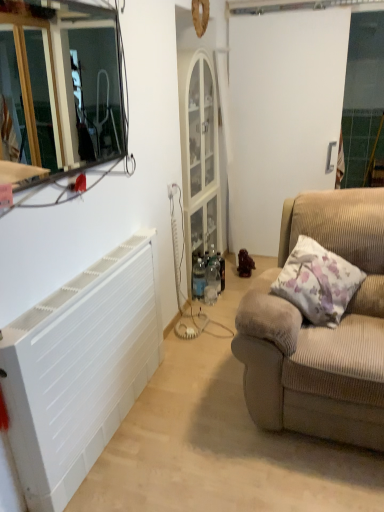
Question: Should I look upward or downward to see metallic glass window frame at upper left?

Choices:
 (A) down
 (B) up

Answer: (B)

Question: Considering the relative sizes of fluffy beige pillow at right and metallic glass window frame at upper left in the image provided, is fluffy beige pillow at right smaller than metallic glass window frame at upper left?

Choices:
 (A) yes
 (B) no

Answer: (B)

Question: Is fluffy beige pillow at right turned away from metallic glass window frame at upper left?

Choices:
 (A) no
 (B) yes

Answer: (A)

Question: Is metallic glass window frame at upper left located within fluffy beige pillow at right?

Choices:
 (A) yes
 (B) no

Answer: (B)

Question: Can you confirm if fluffy beige pillow at right is taller than metallic glass window frame at upper left?

Choices:
 (A) no
 (B) yes

Answer: (A)

Question: Does fluffy beige pillow at right come behind metallic glass window frame at upper left?

Choices:
 (A) yes
 (B) no

Answer: (A)

Question: Is fluffy beige pillow at right at the left side of metallic glass window frame at upper left?

Choices:
 (A) no
 (B) yes

Answer: (A)

Question: From a real-world perspective, is fluffy beige pillow at right physically below brown matte figurine at center-right?

Choices:
 (A) no
 (B) yes

Answer: (A)

Question: Is fluffy beige pillow at right aimed at brown matte figurine at center-right?

Choices:
 (A) yes
 (B) no

Answer: (B)

Question: Considering the relative positions of fluffy beige pillow at right and brown matte figurine at center-right in the image provided, is fluffy beige pillow at right to the right of brown matte figurine at center-right from the viewer's perspective?

Choices:
 (A) no
 (B) yes

Answer: (B)

Question: Is brown matte figurine at center-right at the back of fluffy beige pillow at right?

Choices:
 (A) yes
 (B) no

Answer: (B)

Question: Does fluffy beige pillow at right contain brown matte figurine at center-right?

Choices:
 (A) no
 (B) yes

Answer: (A)

Question: Is fluffy beige pillow at right behind brown matte figurine at center-right?

Choices:
 (A) yes
 (B) no

Answer: (B)

Question: Does brown matte figurine at center-right turn towards beige corduroy couch at right?

Choices:
 (A) yes
 (B) no

Answer: (B)